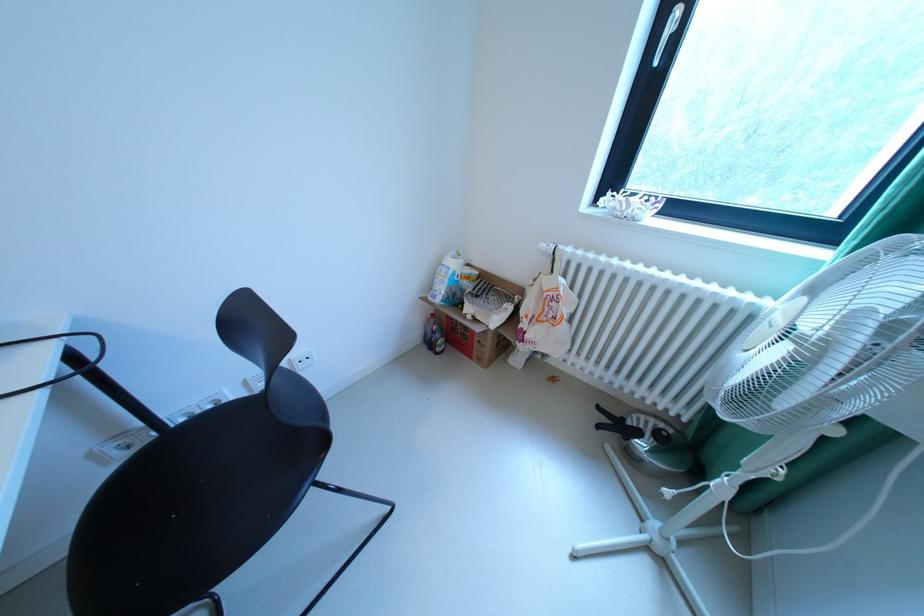
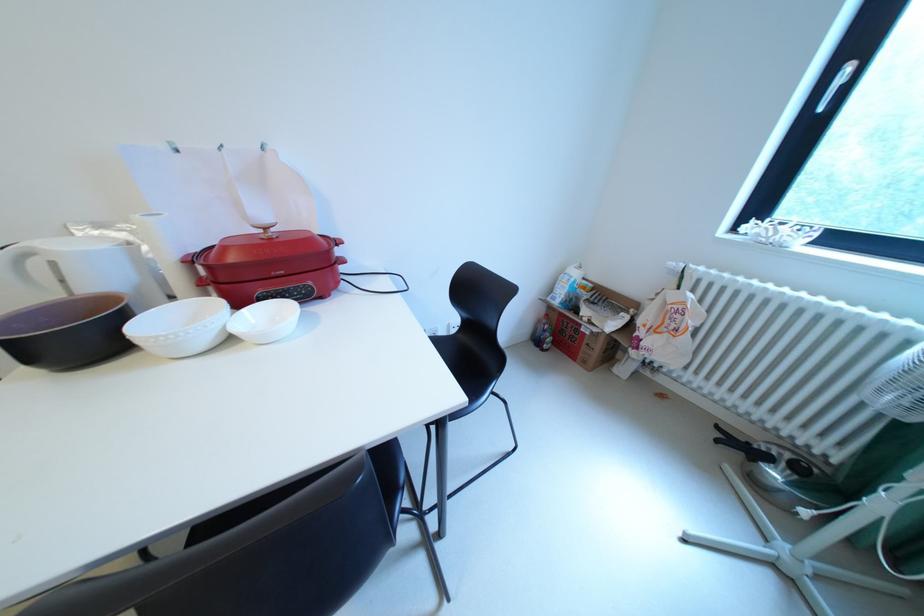
The point at [556,283] is marked in the first image. Where is the corresponding point in the second image?

(682, 297)